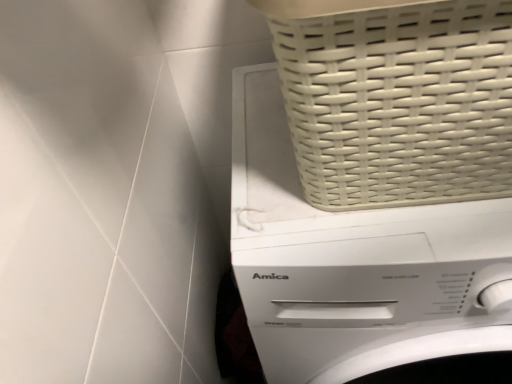
What do you see at coordinates (354, 263) in the screenshot? I see `white plastic washing machine at upper right` at bounding box center [354, 263].

You are a GUI agent. You are given a task and a screenshot of the screen. Output one action in this format:
    pyautogui.click(x=<x>, y=<y>)
    Task: Click on the white plastic washing machine at upper right
    
    Given the screenshot: What is the action you would take?
    pyautogui.click(x=354, y=263)

Identify the location of white woven basket at upper right. This screenshot has width=512, height=384. (396, 99).

Describe the element at coordinates (396, 99) in the screenshot. The image size is (512, 384). I see `white woven basket at upper right` at that location.

Locate an element on the screen. The width and height of the screenshot is (512, 384). white plastic washing machine at upper right is located at coordinates (354, 263).

In the scene shown: Can you confirm if white woven basket at upper right is positioned to the left of white plastic washing machine at upper right?

Correct, you'll find white woven basket at upper right to the left of white plastic washing machine at upper right.

Between white woven basket at upper right and white plastic washing machine at upper right, which one is positioned in front?

white woven basket at upper right is closer to the camera.

Is point (278, 55) positioned after point (401, 316)?

No, it is in front of (401, 316).

From the image's perspective, which one is positioned higher, white woven basket at upper right or white plastic washing machine at upper right?

From the image's view, white woven basket at upper right is above.

From a real-world perspective, is white woven basket at upper right on white plastic washing machine at upper right?

Indeed, from a real-world perspective, white woven basket at upper right stands above white plastic washing machine at upper right.

Between white woven basket at upper right and white plastic washing machine at upper right, which one has larger width?

white plastic washing machine at upper right is wider.

Considering the sizes of white woven basket at upper right and white plastic washing machine at upper right in the image, is white woven basket at upper right taller or shorter than white plastic washing machine at upper right?

Clearly, white woven basket at upper right is shorter compared to white plastic washing machine at upper right.

Considering the relative sizes of white woven basket at upper right and white plastic washing machine at upper right in the image provided, is white woven basket at upper right smaller than white plastic washing machine at upper right?

Correct, white woven basket at upper right occupies less space than white plastic washing machine at upper right.

Is white woven basket at upper right located outside white plastic washing machine at upper right?

Yes.

Would you consider white woven basket at upper right to be distant from white plastic washing machine at upper right?

No, white woven basket at upper right is in close proximity to white plastic washing machine at upper right.

Could you tell me if white woven basket at upper right is turned towards white plastic washing machine at upper right?

A: No, white woven basket at upper right does not turn towards white plastic washing machine at upper right.

What's the angular difference between white woven basket at upper right and white plastic washing machine at upper right's facing directions?

The facing directions of white woven basket at upper right and white plastic washing machine at upper right are 3.09e-05 degrees apart.

Could you measure the distance between white woven basket at upper right and white plastic washing machine at upper right?

They are 5.40 inches apart.

Identify the location of washing machine that is below the white woven basket at upper right (from the image's perspective). (354, 263).

Which object is positioned more to the left, white plastic washing machine at upper right or white woven basket at upper right?

Positioned to the left is white woven basket at upper right.

Who is more distant, white plastic washing machine at upper right or white woven basket at upper right?

white plastic washing machine at upper right is behind.

Does point (330, 372) appear closer or farther from the camera than point (475, 111)?

Clearly, point (330, 372) is more distant from the camera than point (475, 111).

From the image's perspective, is white plastic washing machine at upper right located beneath white woven basket at upper right?

Correct, white plastic washing machine at upper right appears lower than white woven basket at upper right in the image.

From a real-world perspective, is white plastic washing machine at upper right above or below white woven basket at upper right?

white plastic washing machine at upper right is situated lower than white woven basket at upper right in the real world.

Looking at this image, considering the sizes of objects white plastic washing machine at upper right and white woven basket at upper right in the image provided, who is thinner, white plastic washing machine at upper right or white woven basket at upper right?

white woven basket at upper right is thinner.

Who is shorter, white plastic washing machine at upper right or white woven basket at upper right?

white woven basket at upper right is shorter.

Considering the relative sizes of white plastic washing machine at upper right and white woven basket at upper right in the image provided, is white plastic washing machine at upper right smaller than white woven basket at upper right?

No, white plastic washing machine at upper right is not smaller than white woven basket at upper right.

Is white plastic washing machine at upper right surrounding white woven basket at upper right?

No, white woven basket at upper right is not inside white plastic washing machine at upper right.

Is white plastic washing machine at upper right in contact with white woven basket at upper right?

No, white plastic washing machine at upper right is not touching white woven basket at upper right.

Is white plastic washing machine at upper right oriented away from white woven basket at upper right?

white plastic washing machine at upper right is not turned away from white woven basket at upper right.

This screenshot has height=384, width=512. Find the location of `basket above the white plastic washing machine at upper right (from the image's perspective)`. basket above the white plastic washing machine at upper right (from the image's perspective) is located at coordinates (396, 99).

Identify the location of washing machine behind the white woven basket at upper right. (354, 263).

Image resolution: width=512 pixels, height=384 pixels. In order to click on basket lying above the white plastic washing machine at upper right (from the image's perspective) in this screenshot , I will do `click(396, 99)`.